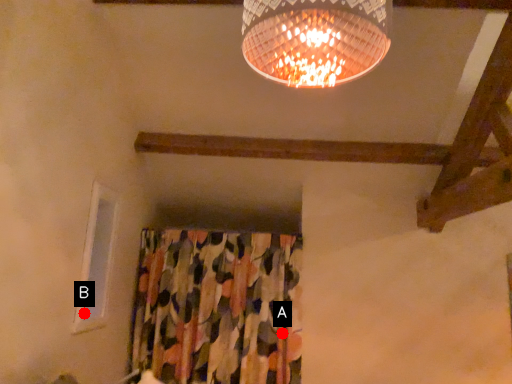
Question: Two points are circled on the image, labeled by A and B beside each circle. Which point appears farthest from the camera in this image?

Choices:
 (A) A is further
 (B) B is further

Answer: (A)